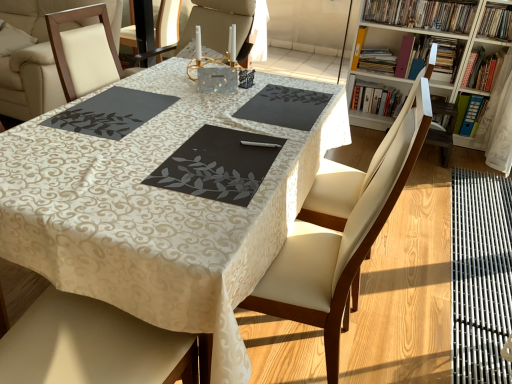
At what (x,y) coordinates should I click in order to perform the action: click on vacant region in front of dark gray matte placemat at center, the third place mat positioned from the right. Please return your answer as a coordinate pair (x, y). The image size is (512, 384). Looking at the image, I should click on (87, 154).